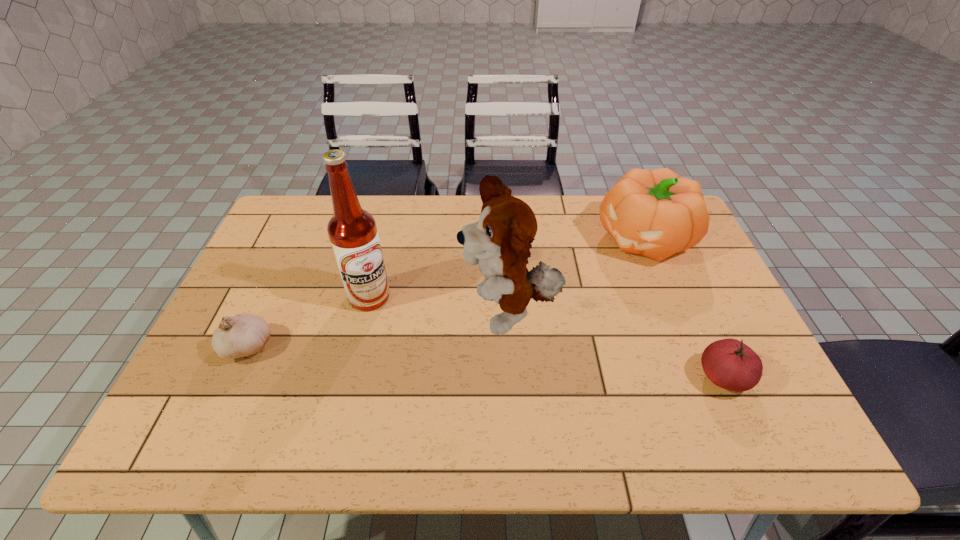
This screenshot has width=960, height=540. In order to click on vacant space on the desktop that is between the garlic and the tomato and is positioned on the face of the second tallest object in this screenshot , I will do `click(410, 357)`.

The image size is (960, 540). What are the coordinates of `vacant space on the desktop that is between the leftmost object and the tomato and is positioned on the carved face of the third tallest object` in the screenshot? It's located at tap(476, 361).

Where is `vacant space on the desktop that is between the garlic and the tomato and is positioned on the label side of the alcohol`? This screenshot has height=540, width=960. vacant space on the desktop that is between the garlic and the tomato and is positioned on the label side of the alcohol is located at coordinates (472, 361).